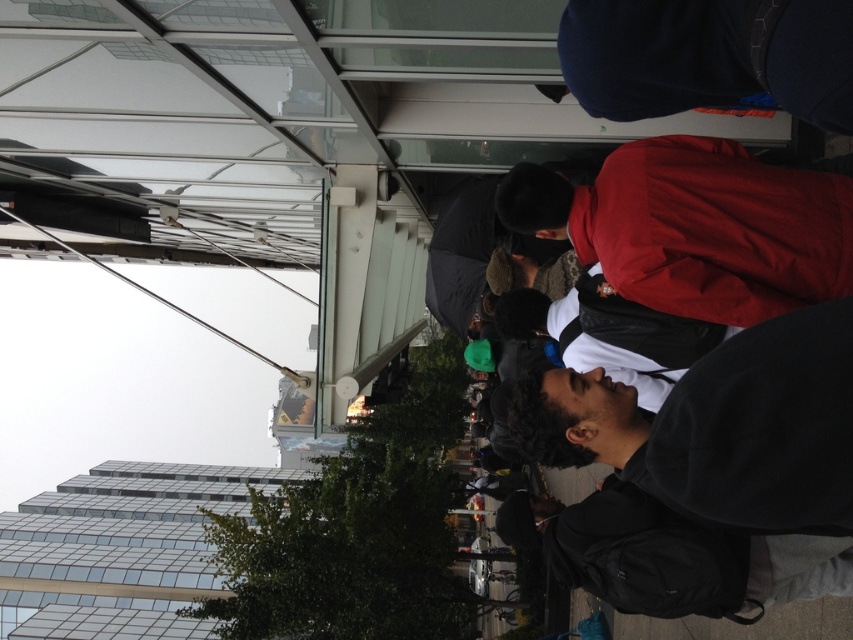
From the picture: You are a photographer trying to capture a candid shot of the red matte jacket at center and the dark gray backpack at center in the urban scene. To ensure both are fully visible in your frame, which object should you adjust your camera angle to focus on first, considering their height differences?

The red matte jacket at center is not as tall as the dark gray backpack at center, so you should focus on the dark gray backpack at center first to ensure it fits within the frame before adjusting for the shorter jacket.

You are standing at the bottom of the staircase and want to hand a document to the person wearing the red matte jacket at center. The black matte jacket at lower right is blocking your path. Can you walk around them without getting too close? The minimum safe distance is 1.5 meters.

The black matte jacket at lower right is 3.27 meters away from the red matte jacket at center. Since the minimum safe distance is 1.5 meters, you can walk around the black matte jacket at lower right while maintaining a safe distance of at least 1.5 meters.

You are standing at the bottom of the staircase and want to hand a package to the person wearing the black matte jacket at lower right. The package is too large to carry while climbing stairs. Can you place the package near the dark gray backpack at center without it being in the way of the staircase?

The black matte jacket at lower right is shorter than the dark gray backpack at center, so placing the package near the dark gray backpack at center would position it higher than the jacket. This should keep the package from blocking the staircase since the backpack is taller and likely placed away from the stair path.